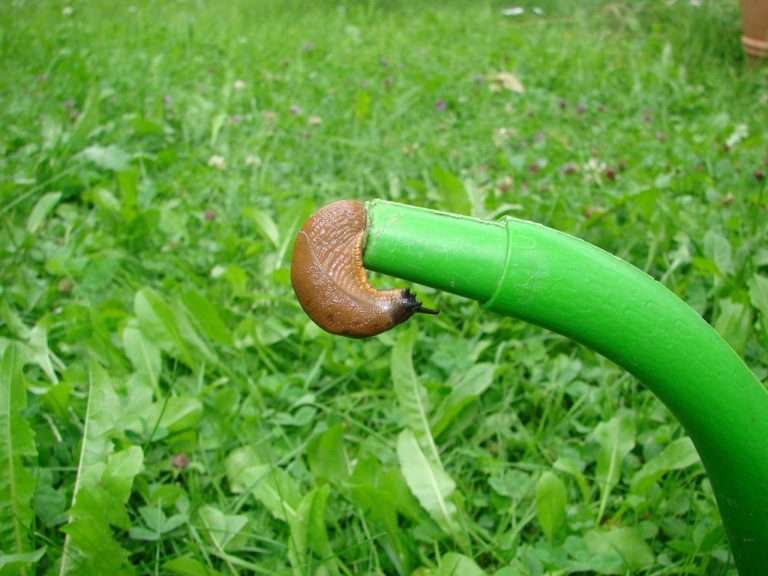
The height and width of the screenshot is (576, 768). I want to click on plant pot, so click(x=756, y=15).